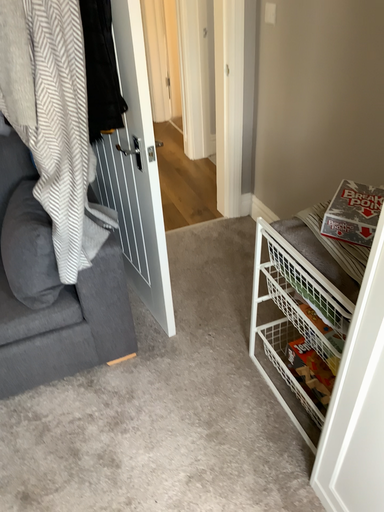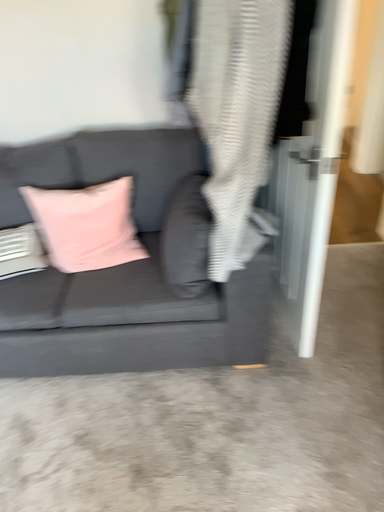
Question: Which way did the camera rotate in the video?

Choices:
 (A) rotated right
 (B) rotated left

Answer: (B)